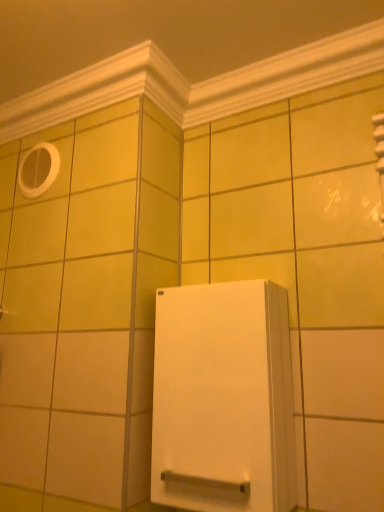
The width and height of the screenshot is (384, 512). Describe the element at coordinates (223, 399) in the screenshot. I see `white matte refrigerator at center` at that location.

Identify the location of white matte refrigerator at center. This screenshot has width=384, height=512. (223, 399).

You are a GUI agent. You are given a task and a screenshot of the screen. Output one action in this format:
    pyautogui.click(x=<x>, y=<y>)
    Task: Click on the white matte refrigerator at center
    The width and height of the screenshot is (384, 512).
    Given the screenshot: What is the action you would take?
    pyautogui.click(x=223, y=399)